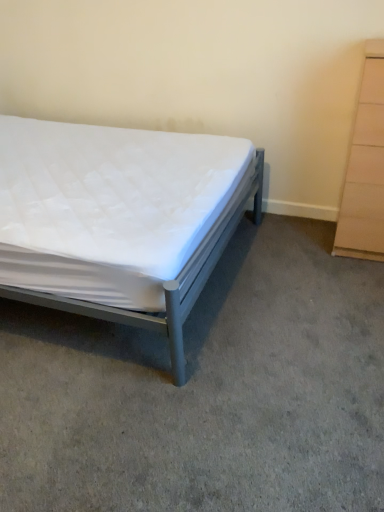
Measure the distance between metallic gray bed at left and camera.

metallic gray bed at left and camera are 4.70 feet apart from each other.

Where is `white quilted mattress at center`? The height and width of the screenshot is (512, 384). white quilted mattress at center is located at coordinates [207, 391].

The width and height of the screenshot is (384, 512). Identify the location of beige wood chest of drawers at right. (365, 168).

Does point (119, 382) come in front of point (368, 78)?

Yes, it is in front of point (368, 78).

Based on the photo, considering the relative sizes of white quilted mattress at center and beige wood chest of drawers at right in the image provided, is white quilted mattress at center shorter than beige wood chest of drawers at right?

Yes.

Considering the relative positions of white quilted mattress at center and beige wood chest of drawers at right in the image provided, is white quilted mattress at center to the right of beige wood chest of drawers at right from the viewer's perspective?

Incorrect, white quilted mattress at center is not on the right side of beige wood chest of drawers at right.

From a real-world perspective, is white quilted mattress at center positioned above or below beige wood chest of drawers at right?

white quilted mattress at center is below beige wood chest of drawers at right.

From the image's perspective, between metallic gray bed at left and white quilted mattress at center, which one is located above?

metallic gray bed at left, from the image's perspective.

This screenshot has height=512, width=384. What are the coordinates of `concrete lying on the right of metallic gray bed at left` in the screenshot? It's located at (207, 391).

Between metallic gray bed at left and white quilted mattress at center, which one is positioned in front?

white quilted mattress at center is more forward.

Looking at this image, from a real-world perspective, who is located higher, metallic gray bed at left or beige wood chest of drawers at right?

beige wood chest of drawers at right is physically above.

Who is shorter, metallic gray bed at left or beige wood chest of drawers at right?

With less height is metallic gray bed at left.

Consider the image. Which object is positioned more to the left, metallic gray bed at left or beige wood chest of drawers at right?

metallic gray bed at left is more to the left.

Based on the photo, from the image's perspective, would you say metallic gray bed at left is shown under beige wood chest of drawers at right?

Yes, from the image's perspective, metallic gray bed at left is below beige wood chest of drawers at right.

Does beige wood chest of drawers at right have a greater width compared to white quilted mattress at center?

Incorrect, the width of beige wood chest of drawers at right does not surpass that of white quilted mattress at center.

Which is nearer, (367, 68) or (131, 407)?

The point (131, 407) is closer.

Identify the location of concrete lying below the beige wood chest of drawers at right (from the image's perspective). The image size is (384, 512). (207, 391).

Can you tell me how much beige wood chest of drawers at right and white quilted mattress at center differ in facing direction?

0.658 degrees separate the facing orientations of beige wood chest of drawers at right and white quilted mattress at center.

Would you say beige wood chest of drawers at right is outside metallic gray bed at left?

Yes, beige wood chest of drawers at right is not within metallic gray bed at left.

Is beige wood chest of drawers at right to the right of metallic gray bed at left from the viewer's perspective?

Yes.

Image resolution: width=384 pixels, height=512 pixels. Identify the location of chest of drawers lying on the right of metallic gray bed at left. (365, 168).

Which of these two, beige wood chest of drawers at right or metallic gray bed at left, is bigger?

With larger size is metallic gray bed at left.

This screenshot has width=384, height=512. In order to click on bed above the white quilted mattress at center (from a real-world perspective) in this screenshot , I will do `click(119, 219)`.

Is white quilted mattress at center touching metallic gray bed at left?

white quilted mattress at center and metallic gray bed at left are not in contact.

Considering the positions of objects white quilted mattress at center and metallic gray bed at left in the image provided, who is more to the left, white quilted mattress at center or metallic gray bed at left?

From the viewer's perspective, metallic gray bed at left appears more on the left side.

I want to click on chest of drawers on the right side of white quilted mattress at center, so click(365, 168).

In order to click on concrete in front of the metallic gray bed at left in this screenshot , I will do `click(207, 391)`.

When comparing their distances from beige wood chest of drawers at right, does metallic gray bed at left or white quilted mattress at center seem closer?

white quilted mattress at center is positioned closer to the anchor beige wood chest of drawers at right.

From the image, which object appears to be nearer to white quilted mattress at center, beige wood chest of drawers at right or metallic gray bed at left?

metallic gray bed at left.

Estimate the real-world distances between objects in this image. Which object is further from white quilted mattress at center, metallic gray bed at left or beige wood chest of drawers at right?

The object further to white quilted mattress at center is beige wood chest of drawers at right.

Looking at the image, which one is located closer to metallic gray bed at left, white quilted mattress at center or beige wood chest of drawers at right?

Based on the image, white quilted mattress at center appears to be nearer to metallic gray bed at left.

Considering their positions, is beige wood chest of drawers at right positioned closer to metallic gray bed at left than white quilted mattress at center?

The object closer to metallic gray bed at left is white quilted mattress at center.

From the picture: From the image, which object appears to be farther from beige wood chest of drawers at right, white quilted mattress at center or metallic gray bed at left?

Among the two, metallic gray bed at left is located further to beige wood chest of drawers at right.

Locate an element on the screen. The height and width of the screenshot is (512, 384). concrete between metallic gray bed at left and beige wood chest of drawers at right from left to right is located at coordinates (207, 391).